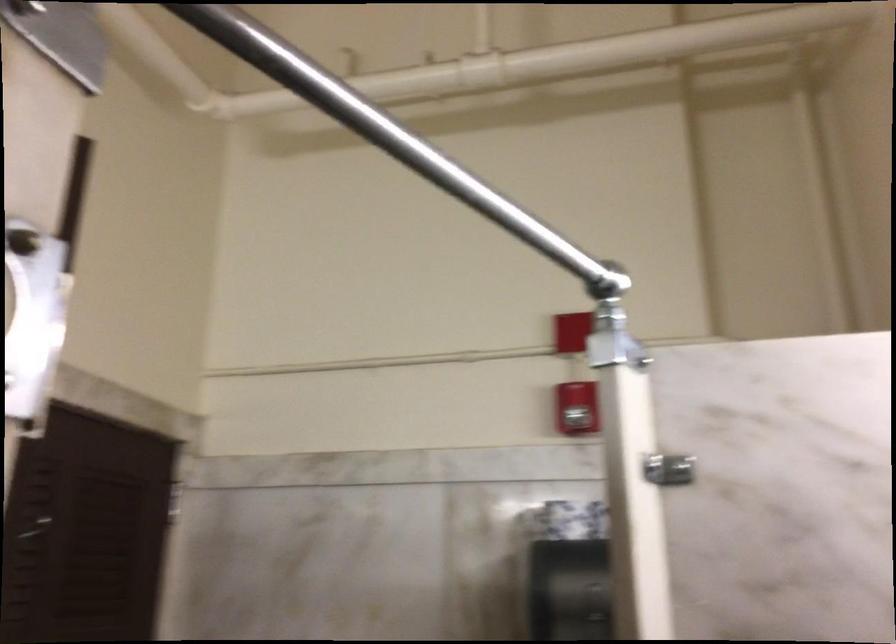
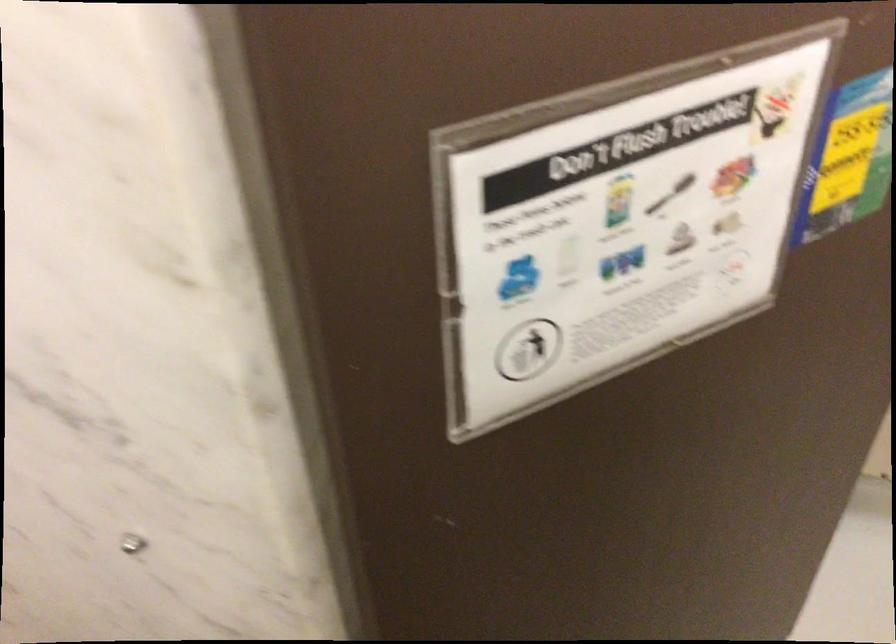
The first image is from the beginning of the video and the second image is from the end. How did the camera likely rotate when shooting the video?

The rotation direction of the camera is left-down.